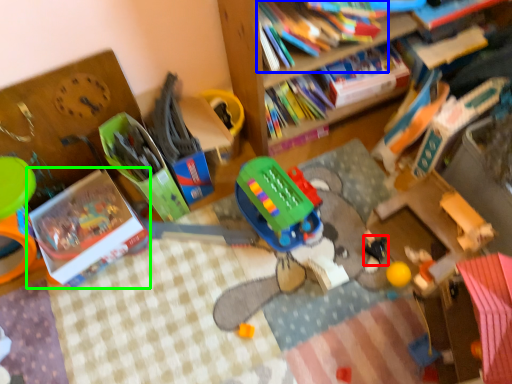
Question: Based on their relative distances, which object is farther from toy (highlighted by a red box)? Choose from book (highlighted by a blue box) and book (highlighted by a green box).

Choices:
 (A) book
 (B) book

Answer: (B)